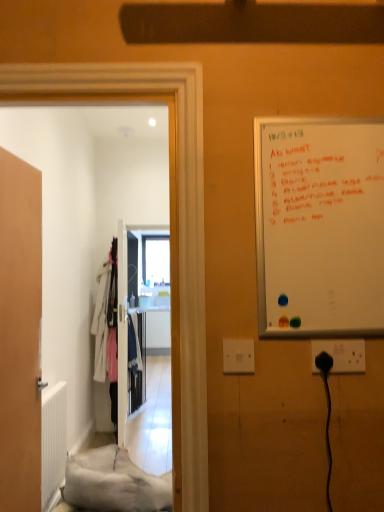
Question: Does whiteboard at right appear on the right side of black plastic socket at lower right, the 1th electric outlet positioned from the right?

Choices:
 (A) no
 (B) yes

Answer: (A)

Question: Is whiteboard at right taller than black plastic socket at lower right, the second electric outlet from the left?

Choices:
 (A) yes
 (B) no

Answer: (A)

Question: Is whiteboard at right at the left side of black plastic socket at lower right, the 1th electric outlet positioned from the right?

Choices:
 (A) no
 (B) yes

Answer: (B)

Question: Is whiteboard at right looking in the opposite direction of black plastic socket at lower right, the 1th electric outlet positioned from the right?

Choices:
 (A) no
 (B) yes

Answer: (A)

Question: Is whiteboard at right directly adjacent to black plastic socket at lower right, the second electric outlet from the left?

Choices:
 (A) yes
 (B) no

Answer: (B)

Question: Is black plastic socket at lower right, the 1th electric outlet positioned from the right, in front of or behind white plastic electric outlet at center, which is counted as the first electric outlet, starting from the left, in the image?

Choices:
 (A) front
 (B) behind

Answer: (B)

Question: Is black plastic socket at lower right, the second electric outlet from the left, inside or outside of white plastic electric outlet at center, which is counted as the first electric outlet, starting from the left?

Choices:
 (A) inside
 (B) outside

Answer: (B)

Question: Looking at the image, does black plastic socket at lower right, the 1th electric outlet positioned from the right, seem bigger or smaller compared to white plastic electric outlet at center, the 2th electric outlet positioned from the right?

Choices:
 (A) small
 (B) big

Answer: (B)

Question: Considering the positions of black plastic socket at lower right, the second electric outlet from the left, and white plastic electric outlet at center, which is counted as the first electric outlet, starting from the left, in the image, is black plastic socket at lower right, the second electric outlet from the left, taller or shorter than white plastic electric outlet at center, which is counted as the first electric outlet, starting from the left,?

Choices:
 (A) short
 (B) tall

Answer: (B)

Question: Considering the relative positions of white plastic electric outlet at center, which is counted as the first electric outlet, starting from the left, and black plastic socket at lower right, the 1th electric outlet positioned from the right, in the image provided, is white plastic electric outlet at center, which is counted as the first electric outlet, starting from the left, to the left or to the right of black plastic socket at lower right, the 1th electric outlet positioned from the right,?

Choices:
 (A) right
 (B) left

Answer: (B)

Question: Do you think white plastic electric outlet at center, which is counted as the first electric outlet, starting from the left, is within black plastic socket at lower right, the second electric outlet from the left, or outside of it?

Choices:
 (A) inside
 (B) outside

Answer: (B)

Question: Is point (238, 340) positioned closer to the camera than point (360, 366)?

Choices:
 (A) closer
 (B) farther

Answer: (A)

Question: From the image's perspective, is white plastic electric outlet at center, which is counted as the first electric outlet, starting from the left, located above or below black plastic socket at lower right, the second electric outlet from the left?

Choices:
 (A) below
 (B) above

Answer: (A)

Question: Based on their sizes in the image, would you say metallic silver clothes at center is bigger or smaller than wooden door at left?

Choices:
 (A) big
 (B) small

Answer: (A)

Question: From the image's perspective, relative to wooden door at left, is metallic silver clothes at center above or below?

Choices:
 (A) below
 (B) above

Answer: (A)